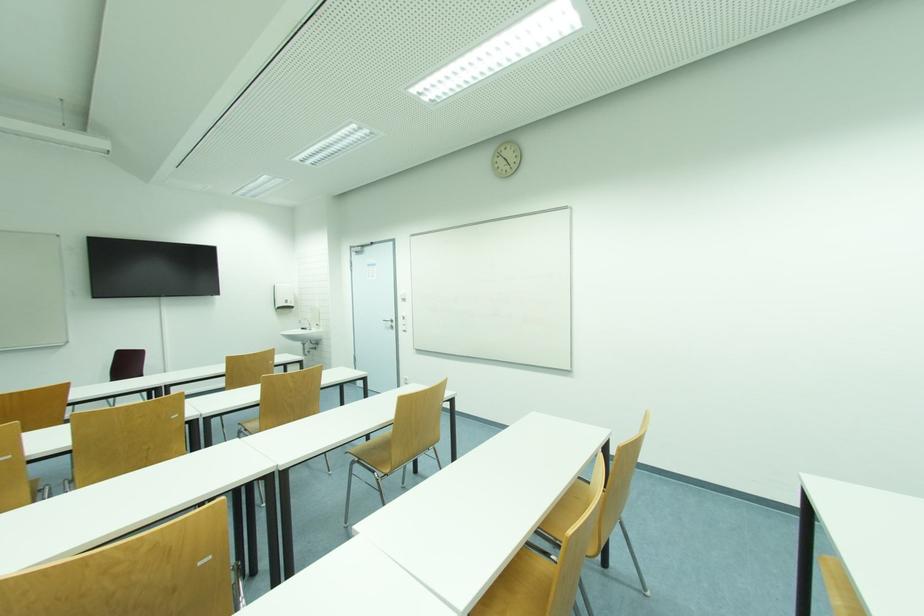
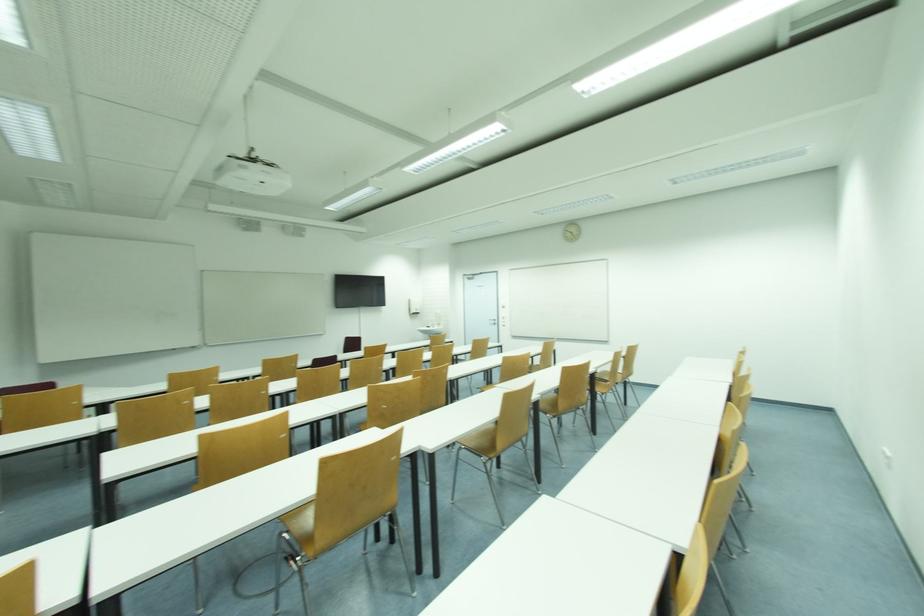
From the picture: In a continuous first-person perspective shot, in which direction is the camera moving?

The cameraman moved toward left, backward.